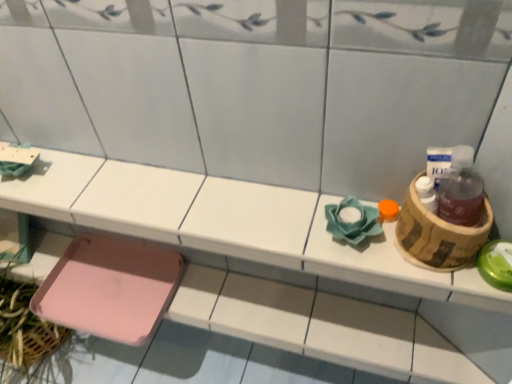
Image resolution: width=512 pixels, height=384 pixels. What do you see at coordinates (273, 263) in the screenshot?
I see `pink plastic tray at lower left` at bounding box center [273, 263].

Image resolution: width=512 pixels, height=384 pixels. I want to click on brown cardboard basket at right, so click(x=438, y=235).

Measure the distance between point (461,231) and camera.

They are 66.60 centimeters apart.

Find the location of a particular element. This screenshot has height=384, width=512. pink plastic tray at lower left is located at coordinates (273, 263).

Based on the photo, which object is positioned more to the right, pink plastic step stool at lower left or pink plastic tray at lower left?

From the viewer's perspective, pink plastic tray at lower left appears more on the right side.

From the picture: From a real-world perspective, is pink plastic step stool at lower left located higher than pink plastic tray at lower left?

Incorrect, from a real-world perspective, pink plastic step stool at lower left is lower than pink plastic tray at lower left.

Based on their sizes in the image, would you say pink plastic step stool at lower left is bigger or smaller than pink plastic tray at lower left?

Considering their sizes, pink plastic step stool at lower left takes up less space than pink plastic tray at lower left.

Which is in front, pink plastic tray at lower left or pink plastic step stool at lower left?

pink plastic tray at lower left is closer to the camera.

Between pink plastic tray at lower left and pink plastic step stool at lower left, which one has larger width?

pink plastic step stool at lower left.

Considering the sizes of objects pink plastic tray at lower left and pink plastic step stool at lower left in the image provided, who is bigger, pink plastic tray at lower left or pink plastic step stool at lower left?

Bigger between the two is pink plastic tray at lower left.

Is pink plastic tray at lower left directly adjacent to pink plastic step stool at lower left?

There is a gap between pink plastic tray at lower left and pink plastic step stool at lower left.

How far apart are brown cardboard basket at right and pink plastic step stool at lower left?

brown cardboard basket at right is 31.35 inches away from pink plastic step stool at lower left.

Is brown cardboard basket at right at the right side of pink plastic step stool at lower left?

Indeed, brown cardboard basket at right is positioned on the right side of pink plastic step stool at lower left.

Is brown cardboard basket at right smaller than pink plastic step stool at lower left?

Indeed, brown cardboard basket at right has a smaller size compared to pink plastic step stool at lower left.

Which is nearer, (443, 242) or (132, 306)?

The point (443, 242) is more forward.

Does pink plastic step stool at lower left lie in front of brown cardboard basket at right?

No, pink plastic step stool at lower left is further to the viewer.

Considering the positions of point (134, 313) and point (451, 246), is point (134, 313) closer or farther from the camera than point (451, 246)?

Point (134, 313).

Is pink plastic step stool at lower left oriented towards brown cardboard basket at right?

No.

Can brown cardboard basket at right be found inside pink plastic step stool at lower left?

No, brown cardboard basket at right is not a part of pink plastic step stool at lower left.

Is point (32, 275) closer or farther from the camera than point (418, 206)?

Point (32, 275) is farther from the camera than point (418, 206).

Based on their sizes in the image, would you say pink plastic tray at lower left is bigger or smaller than brown cardboard basket at right?

In the image, pink plastic tray at lower left appears to be larger than brown cardboard basket at right.

Find the location of a particular element. The width and height of the screenshot is (512, 384). basket lying on the right of pink plastic tray at lower left is located at coordinates (438, 235).

Is pink plastic tray at lower left oriented away from brown cardboard basket at right?

No, pink plastic tray at lower left is not facing the opposite direction of brown cardboard basket at right.

In the image, is brown cardboard basket at right on the left side or the right side of pink plastic tray at lower left?

Clearly, brown cardboard basket at right is on the right of pink plastic tray at lower left in the image.

Which object is further away from the camera taking this photo, brown cardboard basket at right or pink plastic tray at lower left?

Positioned behind is pink plastic tray at lower left.

Is brown cardboard basket at right surrounding pink plastic tray at lower left?

Actually, pink plastic tray at lower left is outside brown cardboard basket at right.

Image resolution: width=512 pixels, height=384 pixels. In order to click on basket that appears on the right of pink plastic tray at lower left in this screenshot , I will do coord(438,235).

Where is `step stool below the pink plastic tray at lower left (from a real-world perspective)`? This screenshot has height=384, width=512. step stool below the pink plastic tray at lower left (from a real-world perspective) is located at coordinates (110, 288).

Where is `step stool on the left of pink plastic tray at lower left`? step stool on the left of pink plastic tray at lower left is located at coordinates (110, 288).

Estimate the real-world distances between objects in this image. Which object is closer to pink plastic tray at lower left, brown cardboard basket at right or pink plastic step stool at lower left?

The object closer to pink plastic tray at lower left is pink plastic step stool at lower left.

From the image, which object appears to be farther from brown cardboard basket at right, pink plastic step stool at lower left or pink plastic tray at lower left?

pink plastic step stool at lower left lies further to brown cardboard basket at right than the other object.

From the image, which object appears to be farther from pink plastic step stool at lower left, brown cardboard basket at right or pink plastic tray at lower left?

Based on the image, brown cardboard basket at right appears to be further to pink plastic step stool at lower left.

Based on their spatial positions, is pink plastic tray at lower left or pink plastic step stool at lower left closer to brown cardboard basket at right?

pink plastic tray at lower left is closer to brown cardboard basket at right.

Based on their spatial positions, is pink plastic step stool at lower left or brown cardboard basket at right further from pink plastic tray at lower left?

brown cardboard basket at right lies further to pink plastic tray at lower left than the other object.

Considering their positions, is pink plastic tray at lower left positioned closer to pink plastic step stool at lower left than brown cardboard basket at right?

The object closer to pink plastic step stool at lower left is pink plastic tray at lower left.

Find the location of `vanity located between pink plastic step stool at lower left and brown cardboard basket at right in the left-right direction`. vanity located between pink plastic step stool at lower left and brown cardboard basket at right in the left-right direction is located at coordinates point(273,263).